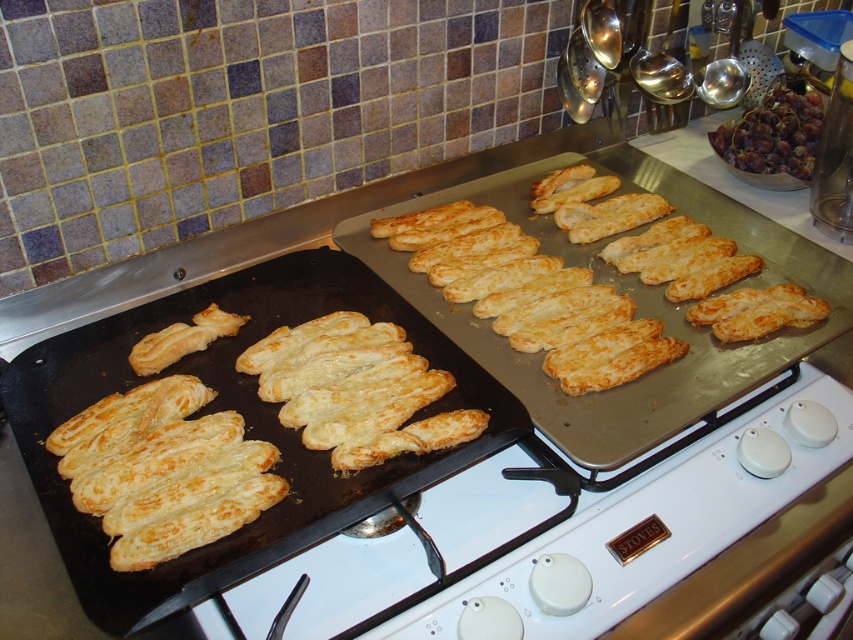
Question: Based on their relative distances, which object is farther from the golden brown puff pastry at left?

Choices:
 (A) golden flaky pastry at center
 (B) golden brown puff pastry at center
 (C) golden crispy pastry at center

Answer: (C)

Question: Which of the following is the farthest from the observer?

Choices:
 (A) golden brown puff pastry at left
 (B) golden crispy pastry at center
 (C) golden brown puff pastry at center

Answer: (B)

Question: Is the position of golden crispy pastry at center more distant than that of golden flaky pastry at center?

Choices:
 (A) yes
 (B) no

Answer: (A)

Question: Does golden brown puff pastry at center have a larger size compared to golden crispy pastry at center?

Choices:
 (A) yes
 (B) no

Answer: (A)

Question: Which object is positioned closest to the golden crispy pastry at center?

Choices:
 (A) golden brown puff pastry at left
 (B) golden brown puff pastry at center
 (C) golden flaky pastry at center
 (D) shiny metallic grapes at upper right

Answer: (B)

Question: Is golden brown puff pastry at left smaller than golden brown puff pastry at center?

Choices:
 (A) yes
 (B) no

Answer: (A)